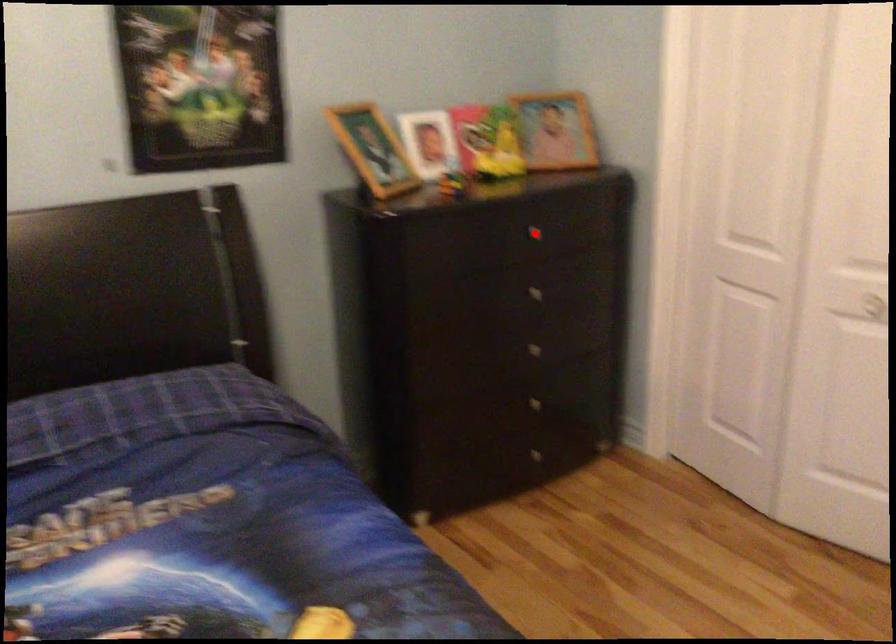
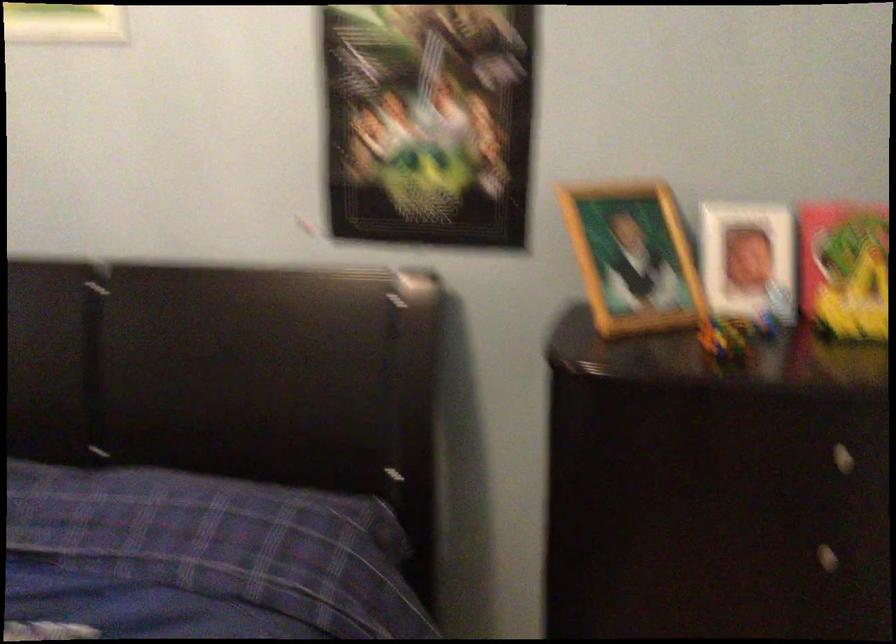
Find the pixel in the second image that matches the highlighted location in the first image.

(840, 458)